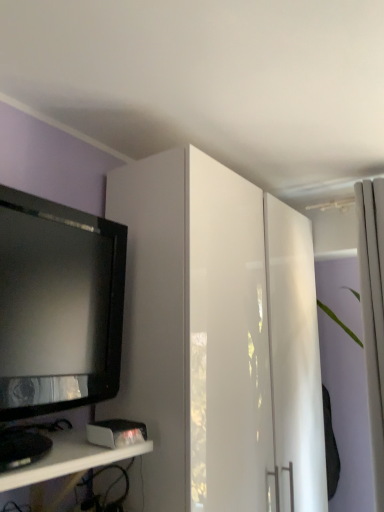
Question: Considering the relative positions of white glossy cabinet at upper center and white fabric curtain at right in the image provided, is white glossy cabinet at upper center in front of white fabric curtain at right?

Choices:
 (A) yes
 (B) no

Answer: (A)

Question: Is white fabric curtain at right at the back of white glossy cabinet at upper center?

Choices:
 (A) no
 (B) yes

Answer: (A)

Question: Considering the relative sizes of white glossy cabinet at upper center and white fabric curtain at right in the image provided, is white glossy cabinet at upper center wider than white fabric curtain at right?

Choices:
 (A) no
 (B) yes

Answer: (B)

Question: Can you confirm if white glossy cabinet at upper center is shorter than white fabric curtain at right?

Choices:
 (A) no
 (B) yes

Answer: (A)

Question: Does white glossy cabinet at upper center have a lesser width compared to white fabric curtain at right?

Choices:
 (A) yes
 (B) no

Answer: (B)

Question: From a real-world perspective, is white glossy shelf at lower left physically located above or below white glossy cabinet at upper center?

Choices:
 (A) below
 (B) above

Answer: (A)

Question: In the image, is white glossy shelf at lower left positioned in front of or behind white glossy cabinet at upper center?

Choices:
 (A) front
 (B) behind

Answer: (A)

Question: Considering the positions of white glossy shelf at lower left and white glossy cabinet at upper center in the image, is white glossy shelf at lower left taller or shorter than white glossy cabinet at upper center?

Choices:
 (A) short
 (B) tall

Answer: (A)

Question: Based on their sizes in the image, would you say white glossy shelf at lower left is bigger or smaller than white glossy cabinet at upper center?

Choices:
 (A) small
 (B) big

Answer: (A)

Question: Is black glossy television at left inside the boundaries of white glossy shelf at lower left, or outside?

Choices:
 (A) outside
 (B) inside

Answer: (A)

Question: Relative to white glossy shelf at lower left, is black glossy television at left in front or behind?

Choices:
 (A) behind
 (B) front

Answer: (A)

Question: From the image's perspective, is black glossy television at left located above or below white glossy shelf at lower left?

Choices:
 (A) above
 (B) below

Answer: (A)

Question: From a real-world perspective, relative to white glossy shelf at lower left, is black glossy television at left vertically above or below?

Choices:
 (A) below
 (B) above

Answer: (B)

Question: Considering the positions of white glossy cabinet at upper center and black glossy television at left in the image, is white glossy cabinet at upper center taller or shorter than black glossy television at left?

Choices:
 (A) tall
 (B) short

Answer: (A)

Question: In the image, is white glossy cabinet at upper center positioned in front of or behind black glossy television at left?

Choices:
 (A) behind
 (B) front

Answer: (A)